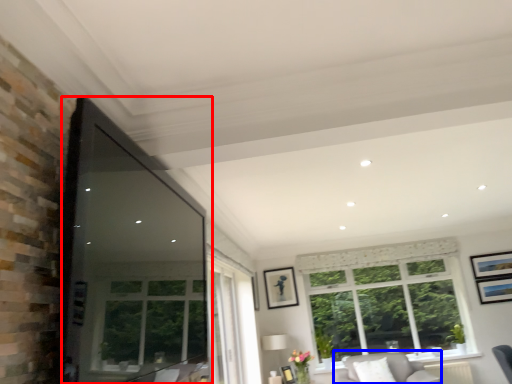
Question: Which object appears farthest to the camera in this image, window screen (highlighted by a red box) or couch (highlighted by a blue box)?

Choices:
 (A) window screen
 (B) couch

Answer: (B)